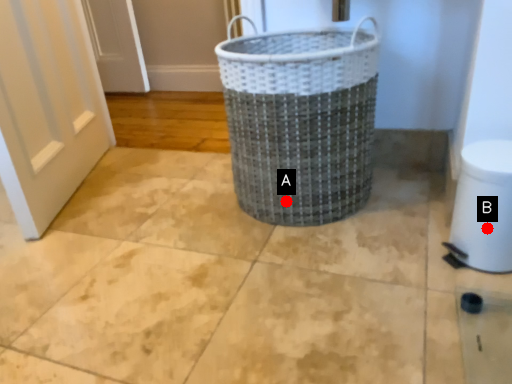
Question: Two points are circled on the image, labeled by A and B beside each circle. Which point is closer to the camera taking this photo?

Choices:
 (A) A is closer
 (B) B is closer

Answer: (B)